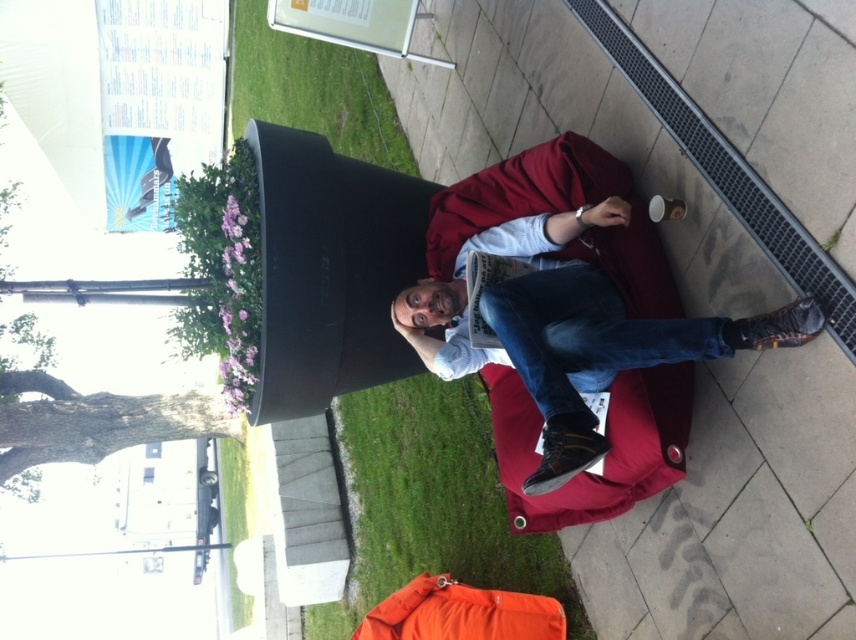
You are standing at the center of the image. Which object is located at point (572,330)?

The matte black couch at lower right is located at point (572,330).

You are standing at the center of the paved area and want to place a new red beanbag chair exactly where the point at point (431, 502) is located. However, the point is on green grass at lower left. Is this location suitable for placing the new beanbag chair?

The point (431, 502) is on green grass at lower left. Since the existing red beanbag chair is on the paved area, placing the new one on the grass might not align with the current setup. The paved area is more appropriate for beanbag placement as per the scene description.

You are standing in the scene and want to place a small decoration between the two points, point (385, 429) and point (236, 19). Which point should the decoration be closer to in order to be nearer to you?

The decoration should be closer to point (385, 429) because it is nearer to the viewer than point (236, 19).